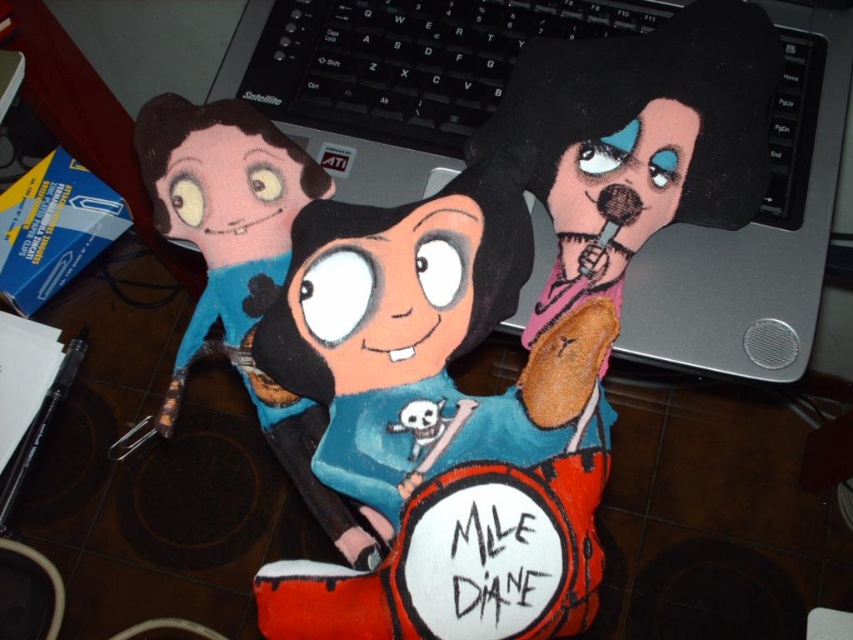
Question: Is silver metallic laptop at center bigger than soft plush doll at center?

Choices:
 (A) yes
 (B) no

Answer: (A)

Question: Which of the following is the closest to the observer?

Choices:
 (A) (296, 483)
 (B) (796, 220)

Answer: (A)

Question: Does silver metallic laptop at center have a larger size compared to soft plush doll at center?

Choices:
 (A) yes
 (B) no

Answer: (A)

Question: Which point is closer to the camera?

Choices:
 (A) click(x=546, y=96)
 (B) click(x=227, y=269)

Answer: (B)

Question: Is silver metallic laptop at center thinner than soft plush doll at center?

Choices:
 (A) no
 (B) yes

Answer: (A)